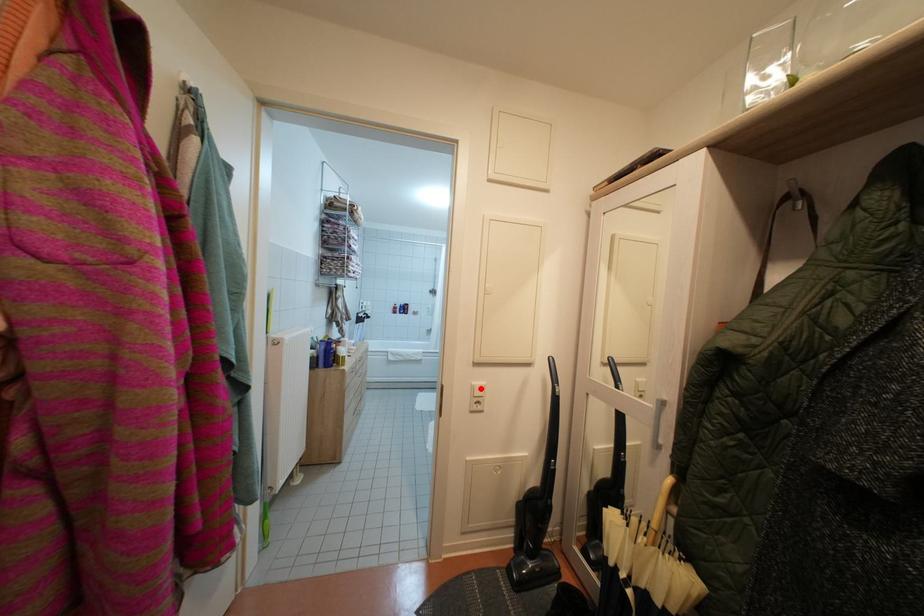
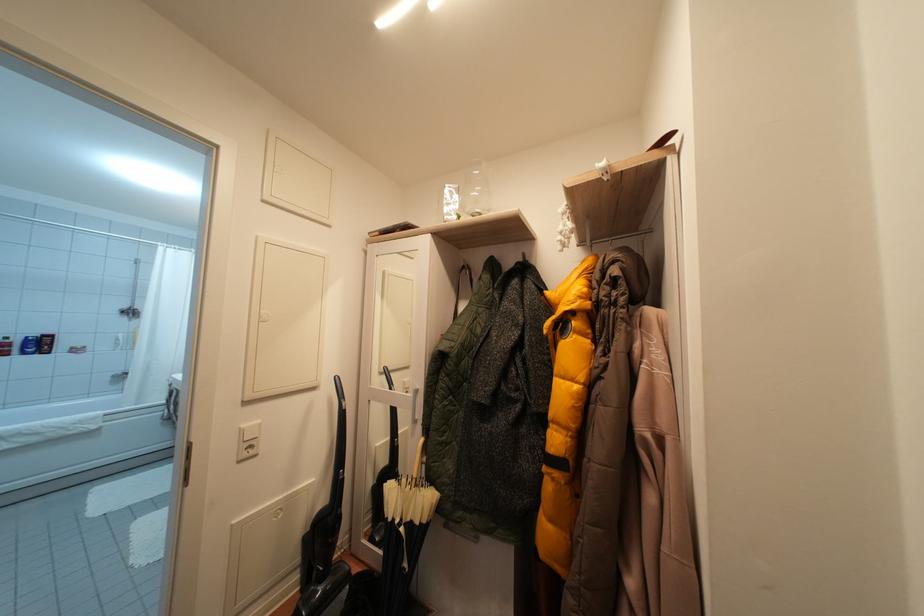
Locate, in the second image, the point that corresponds to the highlighted location in the first image.

(250, 431)